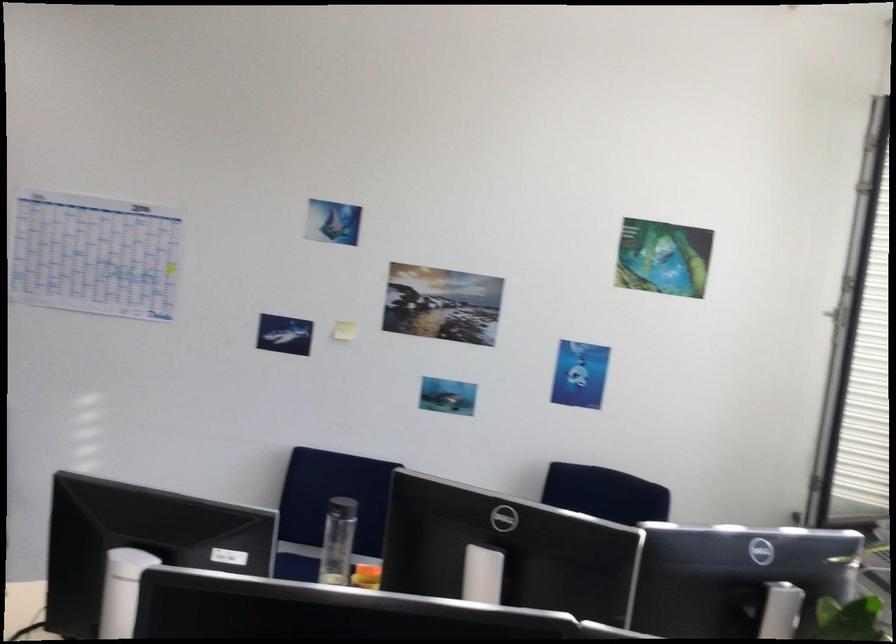
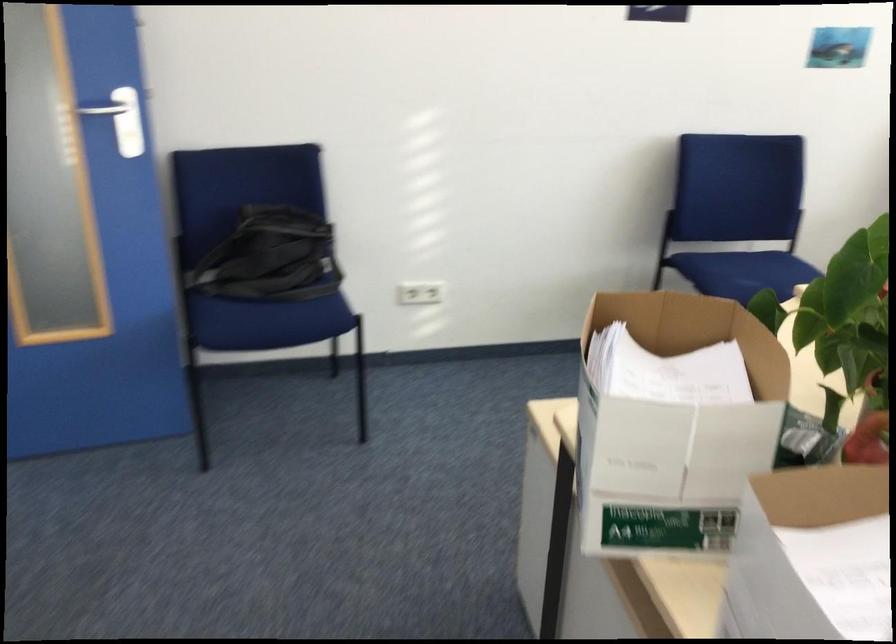
Question: What movement of the cameraman would produce the second image?

Choices:
 (A) Left
 (B) Right
 (C) Forward
 (D) Backward

Answer: (A)